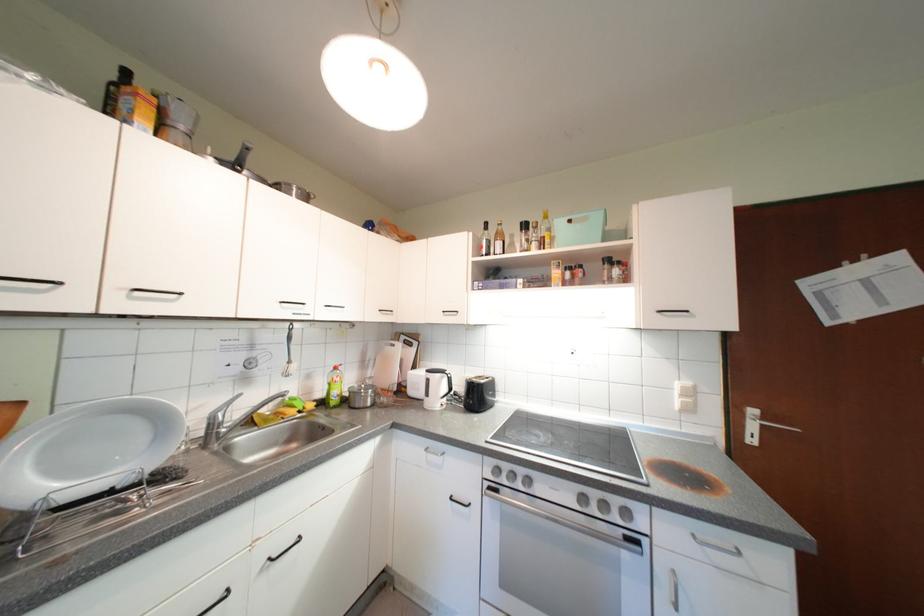
Find where to lift the metal pot. Please return your answer as a coordinate pair (x, y).

(293, 191)